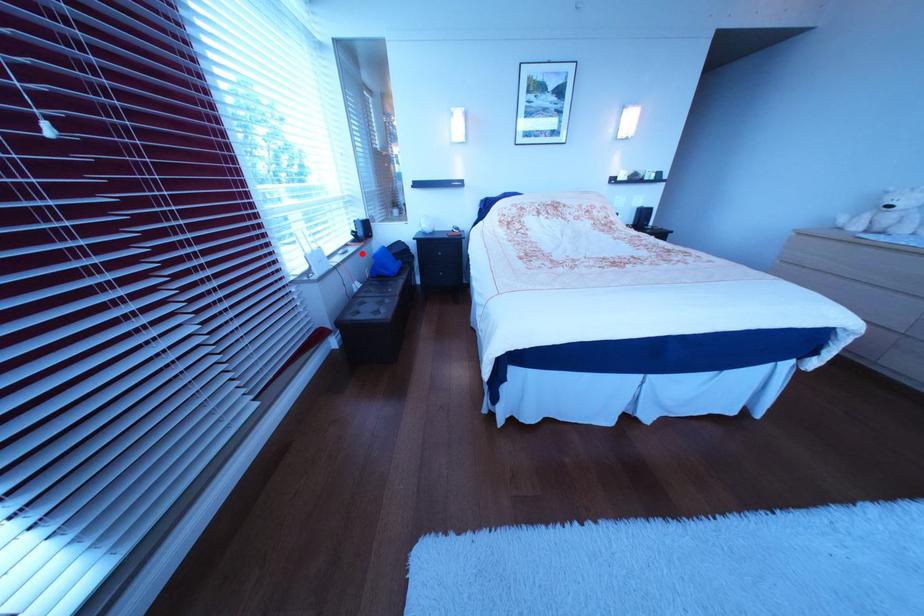
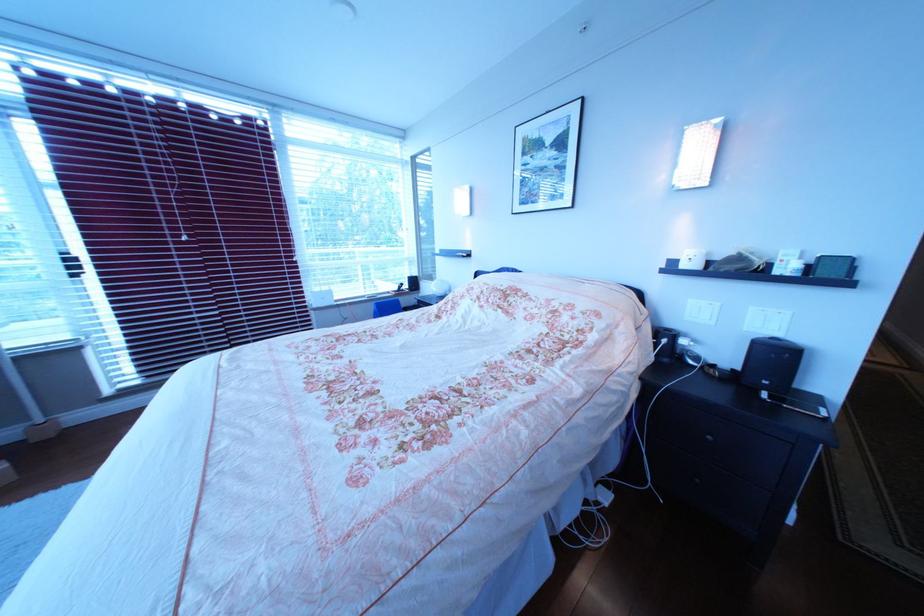
Find the pixel in the second image that matches the highlighted location in the first image.

(392, 299)